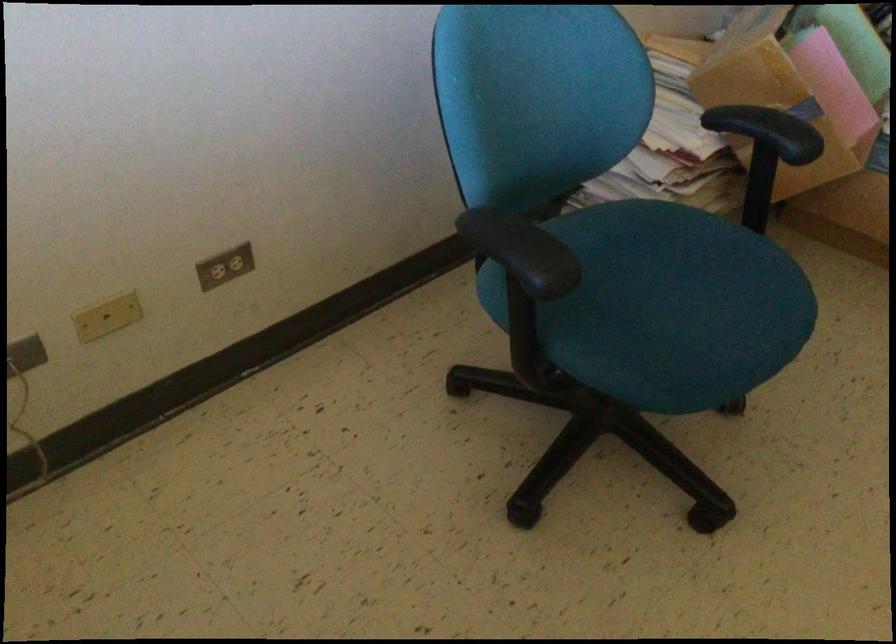
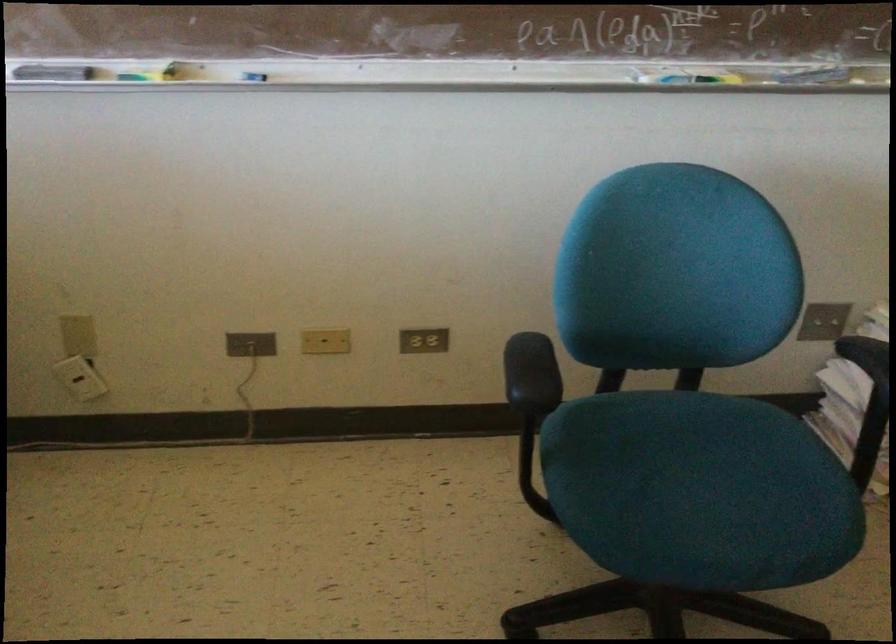
The point at (681,307) is marked in the first image. Where is the corresponding point in the second image?

(700, 491)